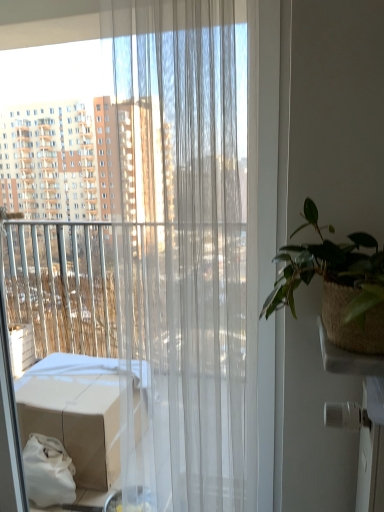
The image size is (384, 512). I want to click on green woven pot at right, so click(x=336, y=285).

Describe the element at coordinates (336, 285) in the screenshot. I see `green woven pot at right` at that location.

Where is `translucent white curtain at center`? This screenshot has height=512, width=384. translucent white curtain at center is located at coordinates (265, 152).

Image resolution: width=384 pixels, height=512 pixels. What do you see at coordinates (265, 152) in the screenshot?
I see `translucent white curtain at center` at bounding box center [265, 152].

Locate an element on the screen. green woven pot at right is located at coordinates (336, 285).

Considering the relative positions of green woven pot at right and translucent white curtain at center in the image provided, is green woven pot at right to the left of translucent white curtain at center from the viewer's perspective?

No, green woven pot at right is not to the left of translucent white curtain at center.

Is the position of green woven pot at right more distant than that of translucent white curtain at center?

No, green woven pot at right is closer to the camera.

Is point (362, 263) positioned after point (261, 436)?

No, it is not.

From the image's perspective, is green woven pot at right above or below translucent white curtain at center?

Clearly, from the image's perspective, green woven pot at right is above translucent white curtain at center.

From a real-world perspective, which object stands above the other?

green woven pot at right is physically above.

Which object is wider, green woven pot at right or translucent white curtain at center?

green woven pot at right is wider.

Considering the sizes of green woven pot at right and translucent white curtain at center in the image, is green woven pot at right taller or shorter than translucent white curtain at center?

In the image, green woven pot at right appears to be shorter than translucent white curtain at center.

Which of these two, green woven pot at right or translucent white curtain at center, is bigger?

translucent white curtain at center.

Is translucent white curtain at center completely or partially inside green woven pot at right?

Definitely not — translucent white curtain at center is not inside green woven pot at right.

Is green woven pot at right touching translucent white curtain at center?

No, green woven pot at right is not making contact with translucent white curtain at center.

Could you tell me if green woven pot at right is turned towards translucent white curtain at center?

No.

Can you tell me how much green woven pot at right and translucent white curtain at center differ in facing direction?

The angular difference between green woven pot at right and translucent white curtain at center is 2.22 degrees.

Locate an element on the screen. Image resolution: width=384 pixels, height=512 pixels. houseplant that appears on the right of translucent white curtain at center is located at coordinates (336, 285).

Would you say translucent white curtain at center is to the left or to the right of green woven pot at right in the picture?

Based on their positions, translucent white curtain at center is located to the left of green woven pot at right.

Considering the positions of objects translucent white curtain at center and green woven pot at right in the image provided, who is behind, translucent white curtain at center or green woven pot at right?

translucent white curtain at center is more distant.

Is point (258, 94) farther from camera compared to point (343, 320)?

Yes, it is behind point (343, 320).

Consider the image. From the image's perspective, is translucent white curtain at center positioned above or below green woven pot at right?

From the image's perspective, translucent white curtain at center appears below green woven pot at right.

From a real-world perspective, who is located lower, translucent white curtain at center or green woven pot at right?

translucent white curtain at center, from a real-world perspective.

Which object is wider, translucent white curtain at center or green woven pot at right?

green woven pot at right is wider.

Is translucent white curtain at center shorter than green woven pot at right?

No, translucent white curtain at center is not shorter than green woven pot at right.

Does translucent white curtain at center have a larger size compared to green woven pot at right?

Yes.

Would you say translucent white curtain at center is outside green woven pot at right?

Yes, translucent white curtain at center is outside of green woven pot at right.

Looking at this image, would you say translucent white curtain at center is a long distance from green woven pot at right?

Actually, translucent white curtain at center and green woven pot at right are a little close together.

Is translucent white curtain at center looking in the opposite direction of green woven pot at right?

translucent white curtain at center is not turned away from green woven pot at right.

Looking at this image, how distant is translucent white curtain at center from green woven pot at right?

A distance of 6.94 inches exists between translucent white curtain at center and green woven pot at right.

The image size is (384, 512). I want to click on curtain that appears behind the green woven pot at right, so (x=265, y=152).

Find the location of `curtain lying on the left of green woven pot at right`. curtain lying on the left of green woven pot at right is located at coordinates (265, 152).

Locate an element on the screen. houseplant in front of the translucent white curtain at center is located at coordinates (336, 285).